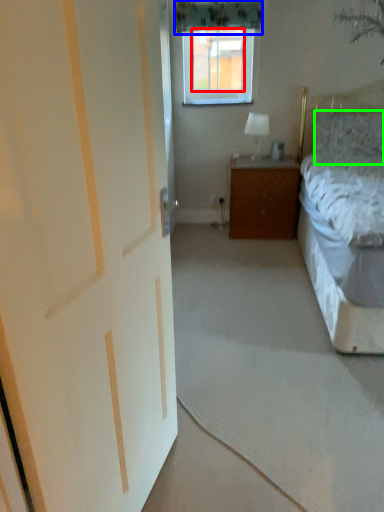
Question: Which is farther away from window screen (highlighted by a red box)? curtain (highlighted by a blue box) or pillow (highlighted by a green box)?

Choices:
 (A) curtain
 (B) pillow

Answer: (B)